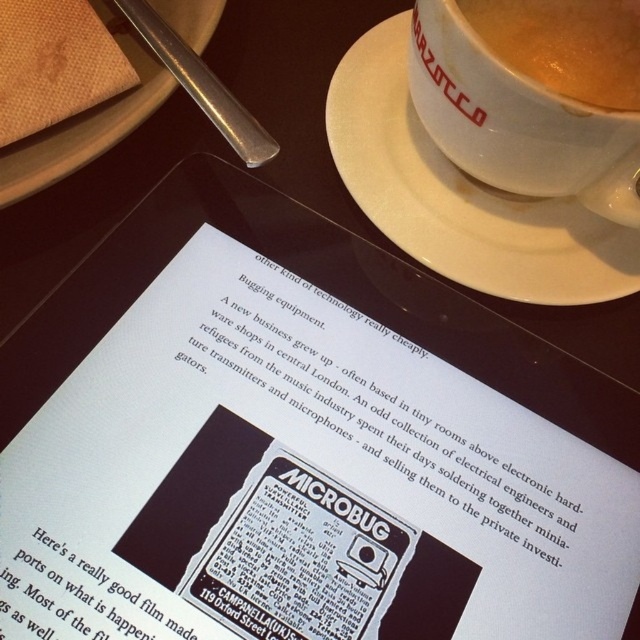
Question: Which of the following is the farthest from the observer?

Choices:
 (A) (461, 1)
 (B) (381, 589)
 (C) (484, 264)
 (D) (125, 36)

Answer: (D)

Question: Among these points, which one is farthest from the camera?

Choices:
 (A) (349, 141)
 (B) (115, 122)
 (C) (65, 620)

Answer: (A)

Question: Can you confirm if white paper at center is positioned above white ceramic saucer at upper center?

Choices:
 (A) no
 (B) yes

Answer: (A)

Question: Which is farther from the matte white cup at upper right?

Choices:
 (A) white ceramic saucer at upper center
 (B) white paper at center

Answer: (B)

Question: Is white ceramic saucer at upper center wider than brown textured plate at upper left?

Choices:
 (A) yes
 (B) no

Answer: (A)

Question: Can you confirm if white paper at center is bigger than white ceramic saucer at upper center?

Choices:
 (A) yes
 (B) no

Answer: (A)